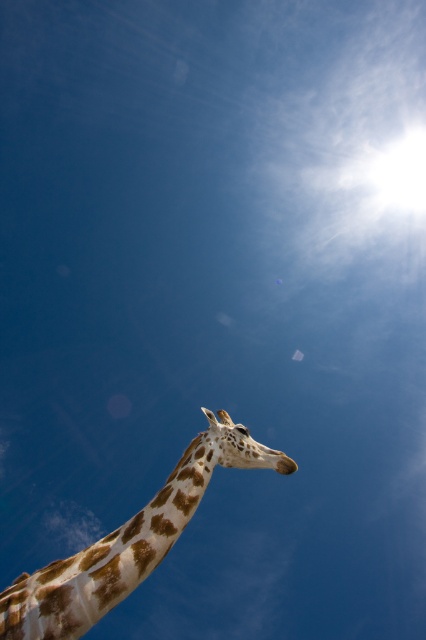
How much distance is there between spotted fur giraffe at lower left and spotted fur giraffe head at center?

spotted fur giraffe at lower left is 37.68 centimeters away from spotted fur giraffe head at center.

Between spotted fur giraffe at lower left and spotted fur giraffe head at center, which one has less height?

spotted fur giraffe head at center

This screenshot has height=640, width=426. Describe the element at coordinates (129, 541) in the screenshot. I see `spotted fur giraffe at lower left` at that location.

Find the location of a particular element. The image size is (426, 640). spotted fur giraffe at lower left is located at coordinates (129, 541).